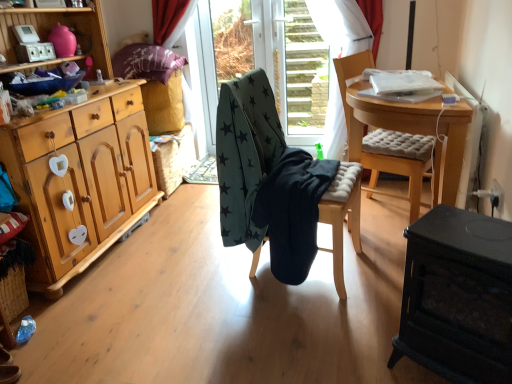
Question: Is dark green fabric stool at center outside transparent glass door at center?

Choices:
 (A) no
 (B) yes

Answer: (B)

Question: Considering the relative sizes of dark green fabric stool at center and transparent glass door at center in the image provided, is dark green fabric stool at center bigger than transparent glass door at center?

Choices:
 (A) no
 (B) yes

Answer: (A)

Question: Is dark green fabric stool at center aimed at transparent glass door at center?

Choices:
 (A) no
 (B) yes

Answer: (A)

Question: Can you confirm if dark green fabric stool at center is taller than transparent glass door at center?

Choices:
 (A) yes
 (B) no

Answer: (B)

Question: Is dark green fabric stool at center next to transparent glass door at center and touching it?

Choices:
 (A) no
 (B) yes

Answer: (A)

Question: Considering the relative sizes of dark green fabric stool at center and transparent glass door at center in the image provided, is dark green fabric stool at center wider than transparent glass door at center?

Choices:
 (A) no
 (B) yes

Answer: (B)

Question: Is light brown cushioned chair at center, the second chair from the left, positioned with its back to transparent plastic screen door at center?

Choices:
 (A) yes
 (B) no

Answer: (B)

Question: Does light brown cushioned chair at center, the second chair from the left, turn towards transparent plastic screen door at center?

Choices:
 (A) no
 (B) yes

Answer: (A)

Question: Can you confirm if light brown cushioned chair at center, marked as the 1th chair in a right-to-left arrangement, is taller than transparent plastic screen door at center?

Choices:
 (A) yes
 (B) no

Answer: (B)

Question: Considering the relative positions of light brown cushioned chair at center, the second chair from the left, and transparent plastic screen door at center in the image provided, is light brown cushioned chair at center, the second chair from the left, behind transparent plastic screen door at center?

Choices:
 (A) yes
 (B) no

Answer: (B)

Question: From the image's perspective, is light brown cushioned chair at center, marked as the 1th chair in a right-to-left arrangement, beneath transparent plastic screen door at center?

Choices:
 (A) no
 (B) yes

Answer: (B)

Question: Considering the relative positions of light brown cushioned chair at center, the second chair from the left, and transparent plastic screen door at center in the image provided, is light brown cushioned chair at center, the second chair from the left, to the right of transparent plastic screen door at center from the viewer's perspective?

Choices:
 (A) no
 (B) yes

Answer: (B)

Question: Does transparent glass door at center contain black matte wood table at lower right?

Choices:
 (A) yes
 (B) no

Answer: (B)